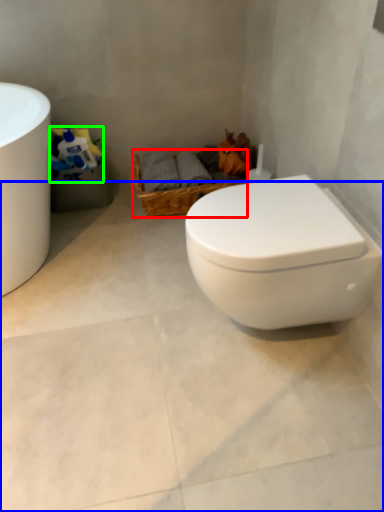
Question: Which is nearer to the basket (highlighted by a red box)? concrete (highlighted by a blue box) or toilet paper (highlighted by a green box).

Choices:
 (A) concrete
 (B) toilet paper

Answer: (B)